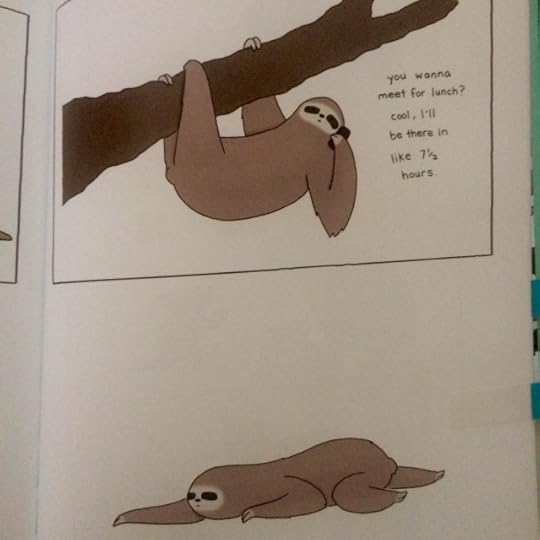
You are a GUI agent. You are given a task and a screenshot of the screen. Output one action in this format:
    pyautogui.click(x=<x>, y=<y>)
    Task: Click on the two sloths on wall
    
    Given the screenshot: What is the action you would take?
    pyautogui.click(x=318, y=478), pyautogui.click(x=288, y=176)